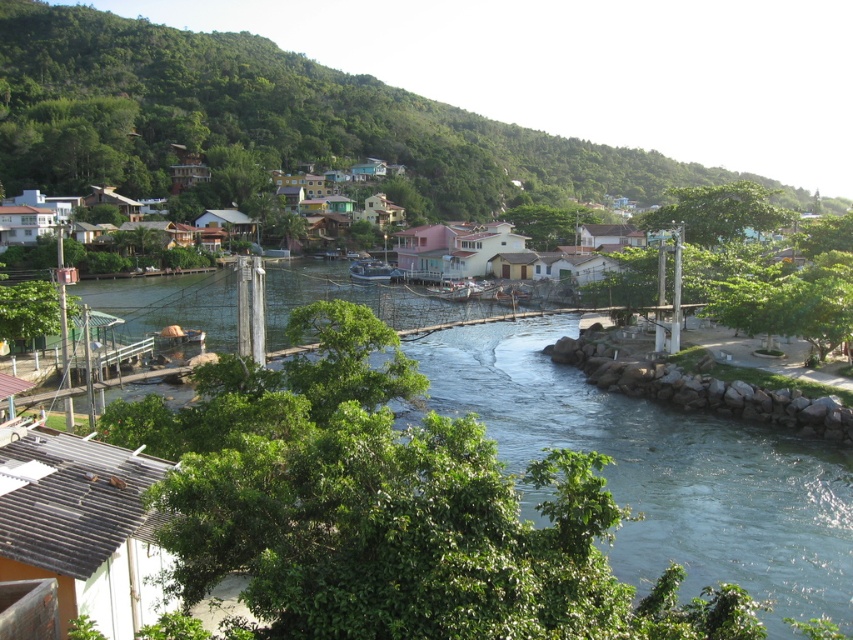
You are a hiker standing at the point specified in the image. Looking at the green leafy hillside at upper center located at point (270, 122), which direction should you head to reach the village below?

The green leafy hillside at upper center is located at point (270, 122). Since the village is below the hillside, you should head downward from the point towards the village.

You are a hiker standing at the base of the green leafy hillside at upper center. You want to reach the metallic silver boat at center. Which direction should you move to get closer to the boat?

Since the green leafy hillside at upper center is closer to you than the metallic silver boat at center, you should move downward or away from the hillside to get closer to the boat.